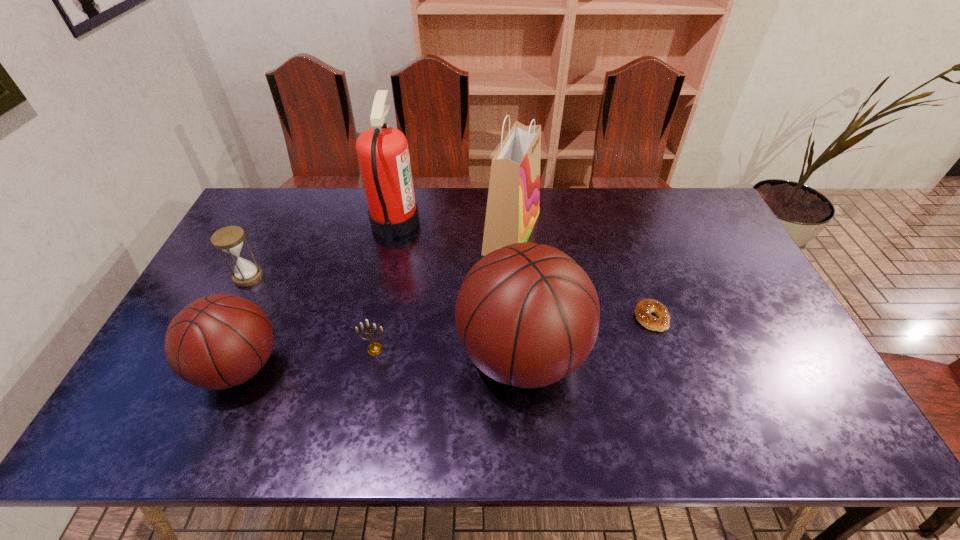
Where is `vacant region between the fifth tallest object and the bagel`? This screenshot has height=540, width=960. vacant region between the fifth tallest object and the bagel is located at coordinates (450, 297).

The width and height of the screenshot is (960, 540). Find the location of `unoccupied area between the shopping bag and the hourglass`. unoccupied area between the shopping bag and the hourglass is located at coordinates (380, 254).

This screenshot has width=960, height=540. In order to click on empty space between the fourth tallest object and the shopping bag in this screenshot , I will do `click(375, 300)`.

This screenshot has height=540, width=960. I want to click on object that is the closest to the candelabrum, so click(x=527, y=315).

I want to click on object identified as the second closest to the fire extinguisher, so pos(527,315).

The height and width of the screenshot is (540, 960). I want to click on vacant space that satisfies the following two spatial constraints: 1. on the front side of the shopping bag; 2. on the right side of the right basketball, so click(521, 355).

This screenshot has width=960, height=540. I want to click on free space that satisfies the following two spatial constraints: 1. on the front side of the third shortest object; 2. on the right side of the left basketball, so click(203, 367).